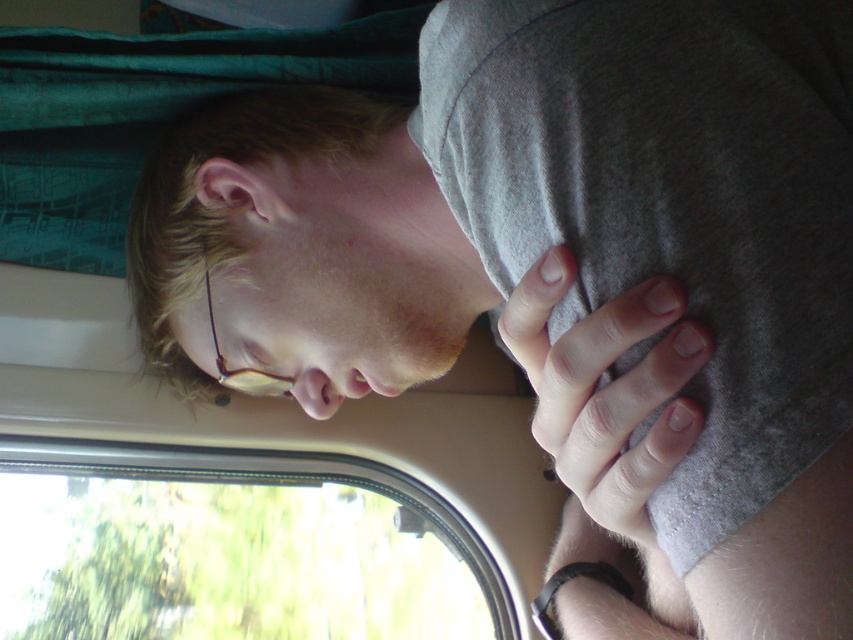
Between matte gray hair at upper center and transparent glass window at lower left, which one is positioned lower?

Positioned lower is transparent glass window at lower left.

Where is `matte gray hair at upper center`? matte gray hair at upper center is located at coordinates (299, 248).

Image resolution: width=853 pixels, height=640 pixels. I want to click on matte gray hair at upper center, so click(x=299, y=248).

The width and height of the screenshot is (853, 640). What do you see at coordinates (299, 248) in the screenshot?
I see `matte gray hair at upper center` at bounding box center [299, 248].

Who is more distant from viewer, (457, 310) or (305, 392)?

The point (305, 392) is more distant.

Locate an element on the screen. The height and width of the screenshot is (640, 853). matte gray hair at upper center is located at coordinates (299, 248).

Between point (258, 577) and point (660, 417), which one is positioned in front?

Point (660, 417) is in front.

Does transparent glass window at lower left have a larger size compared to white matte hand at center?

Correct, transparent glass window at lower left is larger in size than white matte hand at center.

What do you see at coordinates (231, 547) in the screenshot? The image size is (853, 640). I see `transparent glass window at lower left` at bounding box center [231, 547].

Identify the location of transparent glass window at lower left. The height and width of the screenshot is (640, 853). (231, 547).